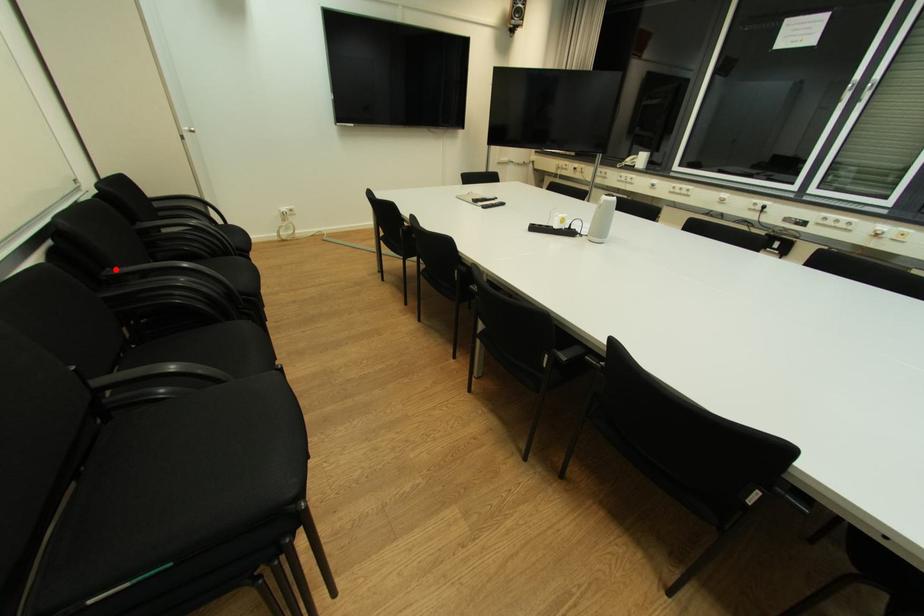
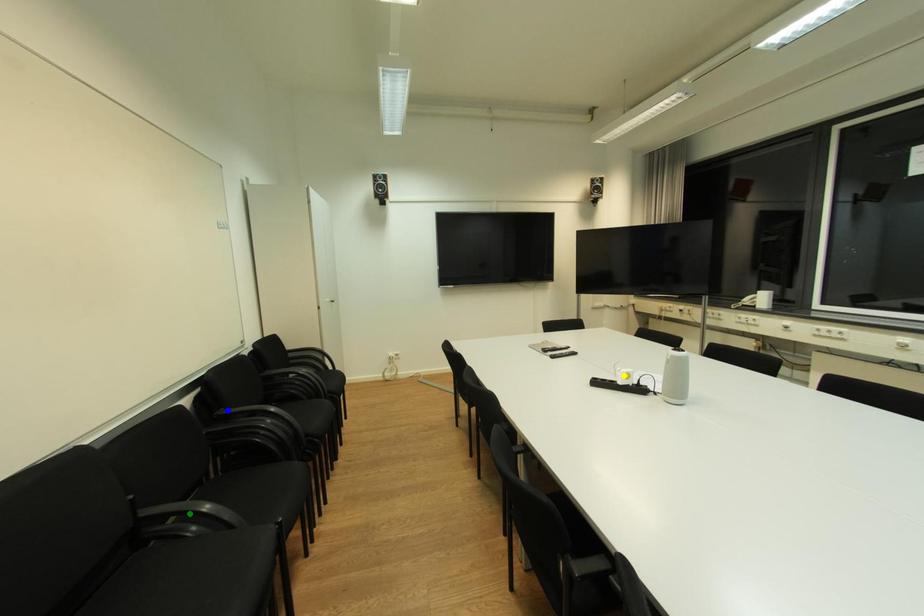
Question: I am providing you with two images of the same scene from different viewpoints. A red point is marked on the first image. You are given multiple points on the second image. Which point in image 2 represents the same 3d spot as the red point in image 1?

Choices:
 (A) yellow point
 (B) blue point
 (C) green point

Answer: (B)